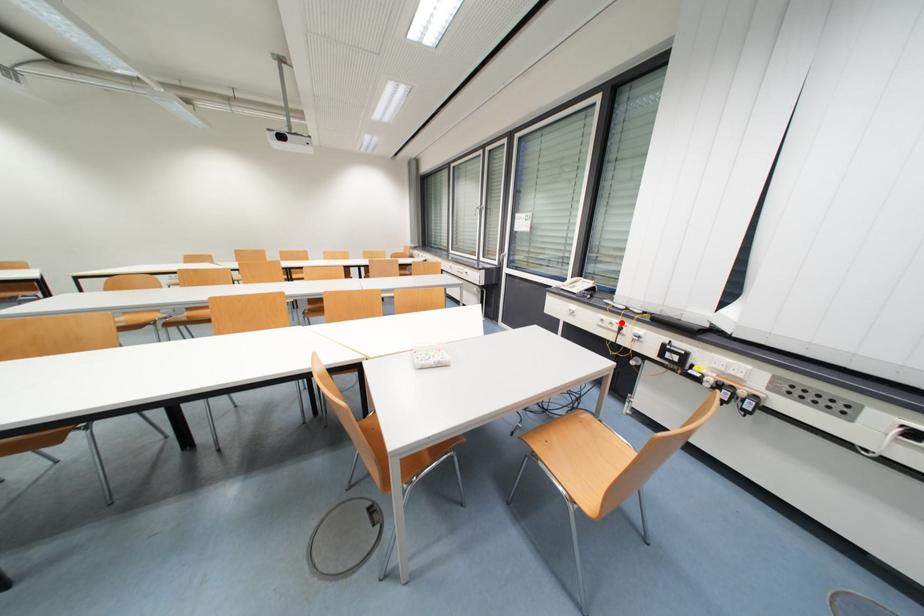
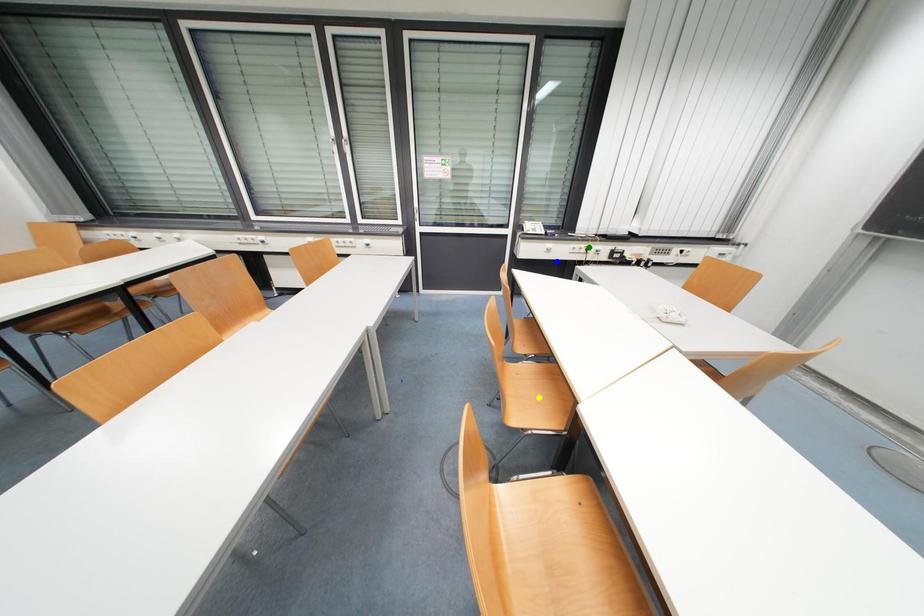
Question: I am providing you with two images of the same scene from different viewpoints. A red point is marked on the first image. You are given multiple points on the second image. Which spot in image 2 lines up with the point in image 1?

Choices:
 (A) blue point
 (B) green point
 (C) yellow point

Answer: (B)